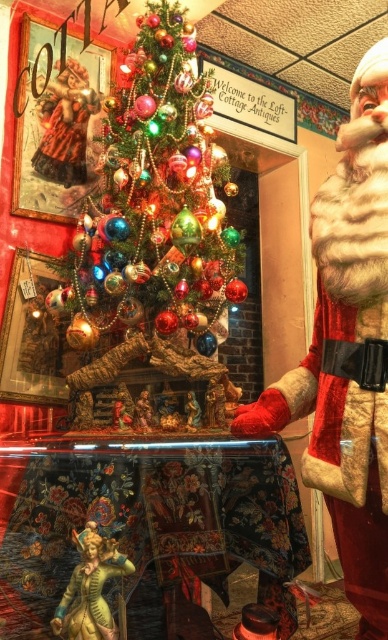
Question: Is shiny glass ornaments at center above fuzzy fur santa at right?

Choices:
 (A) no
 (B) yes

Answer: (B)

Question: Which object is positioned closest to the fuzzy fur santa at right?

Choices:
 (A) shiny glass ornaments at center
 (B) gold metallic statue at lower left

Answer: (B)

Question: Where is fuzzy fur santa at right located in relation to gold metallic statue at lower left in the image?

Choices:
 (A) above
 (B) below

Answer: (A)

Question: Does shiny glass ornaments at center have a larger size compared to fuzzy fur santa at right?

Choices:
 (A) yes
 (B) no

Answer: (A)

Question: Which of the following is the farthest from the observer?

Choices:
 (A) shiny glass ornaments at center
 (B) fuzzy fur santa at right
 (C) gold metallic statue at lower left

Answer: (A)

Question: Which object is farther from the camera taking this photo?

Choices:
 (A) shiny glass ornaments at center
 (B) gold metallic statue at lower left
 (C) fuzzy fur santa at right

Answer: (A)